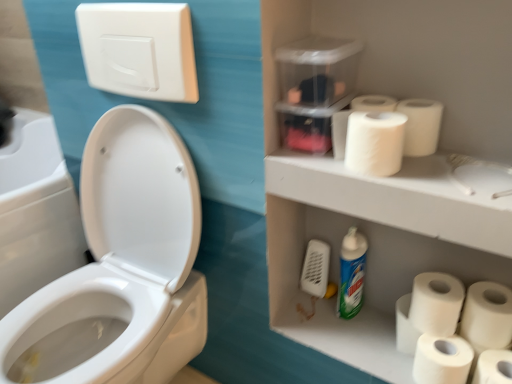
Where is `vacant space in between white glossy cleaning product at lower center and white matte toilet paper at lower right, acting as the second toilet paper starting from the bottom`? This screenshot has height=384, width=512. vacant space in between white glossy cleaning product at lower center and white matte toilet paper at lower right, acting as the second toilet paper starting from the bottom is located at coordinates (374, 336).